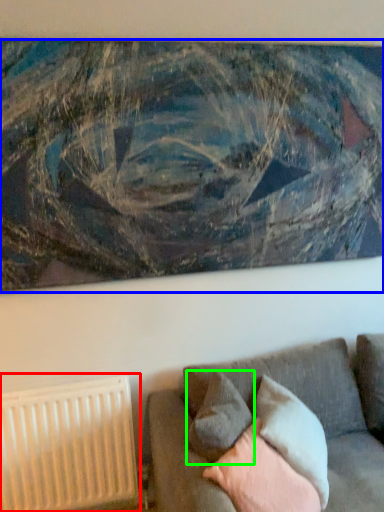
Question: Which object is the farthest from radiator (highlighted by a red box)? Choose among these: picture frame (highlighted by a blue box) or pillow (highlighted by a green box).

Choices:
 (A) picture frame
 (B) pillow

Answer: (A)